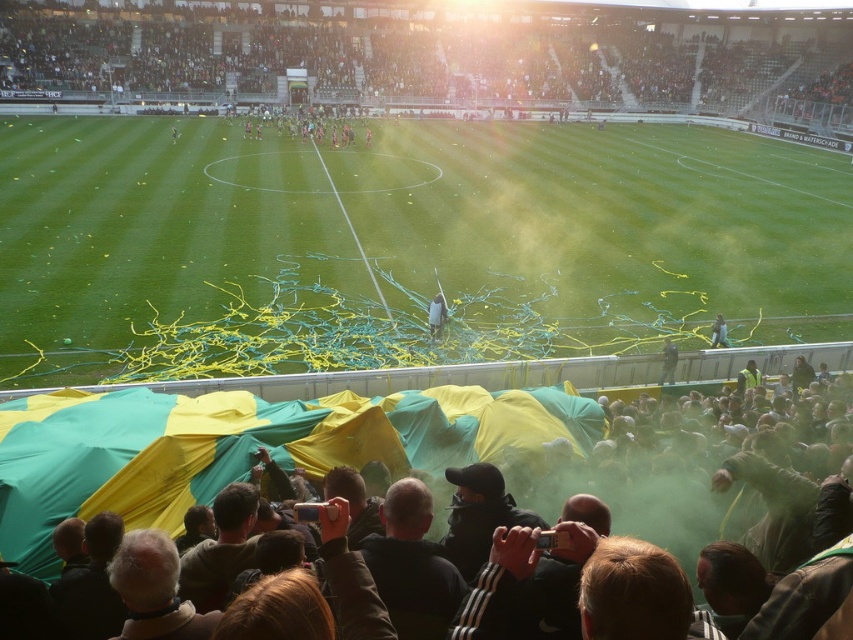
You are a photographer trying to capture a clear shot of the white matte jacket at center from the green fabric crowd at upper center. Based on their relative heights, would the jacket be visible above the crowd?

The green fabric crowd at upper center is much taller than the white matte jacket at center, so the jacket would likely be obscured by the crowd and not visible above them.

You are standing in the soccer stadium and want to move from point A to point B. Point A is at coordinate point (x=55, y=22) and point B is at coordinate point (x=439, y=320). Considering the crowd density, which point is closer to you and easier to reach first?

Point A at coordinate point (x=55, y=22) is closer to you and easier to reach first because it is further to the viewer than point B at coordinate point (x=439, y=320).

You are a photographer at the soccer stadium and want to capture the dark gray jacket at center and the green grass at center in your photo. Which object is positioned to the left side of the other?

The green grass at center is to the left of the dark gray jacket at center.